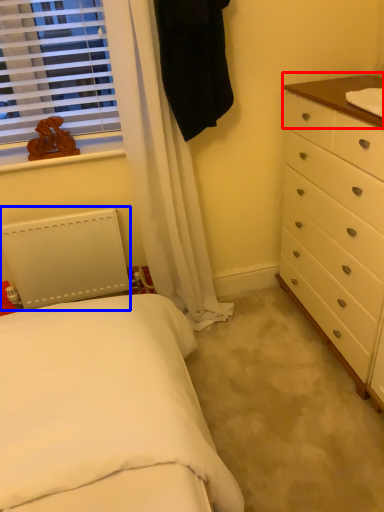
Question: Among these objects, which one is farthest to the camera, counter top (highlighted by a red box) or radiator (highlighted by a blue box)?

Choices:
 (A) counter top
 (B) radiator

Answer: (B)